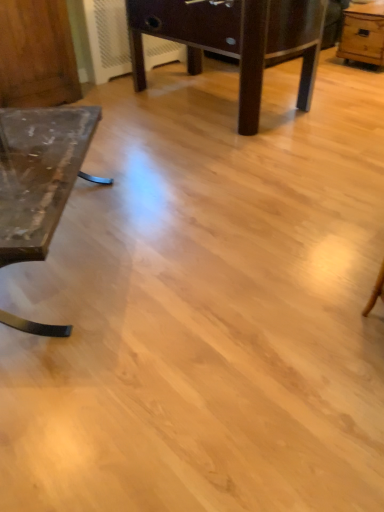
You are a GUI agent. You are given a task and a screenshot of the screen. Output one action in this format:
    pyautogui.click(x=<x>, y=<y>)
    Task: Click on the free space to the right of matte glass table at left, placed as the third table when sorted from right to left
    The height and width of the screenshot is (512, 384).
    Given the screenshot: What is the action you would take?
    pyautogui.click(x=192, y=248)